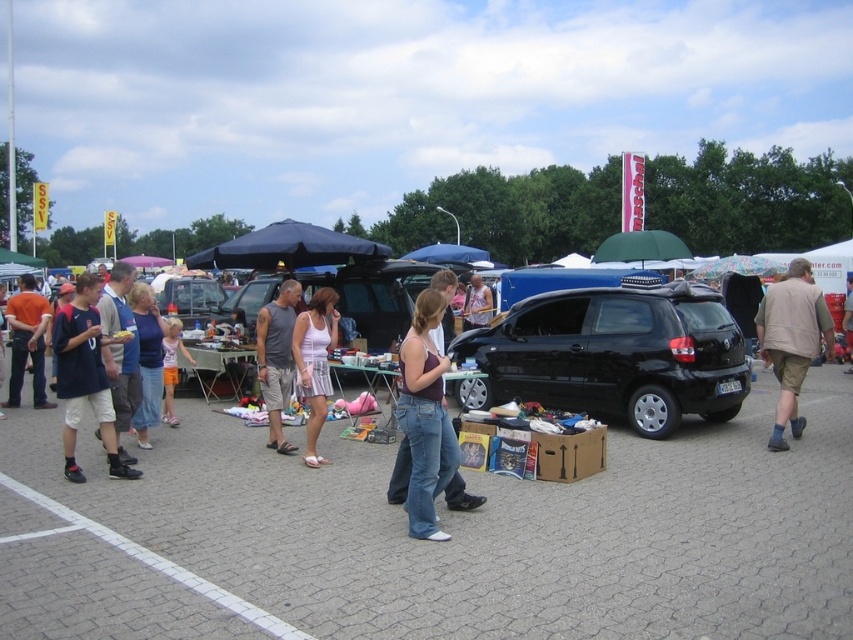
I want to click on metallic silver car at center, so click(x=190, y=300).

Describe the element at coordinates (190, 300) in the screenshot. The image size is (853, 640). I see `metallic silver car at center` at that location.

Where is `metallic silver car at center`? metallic silver car at center is located at coordinates (190, 300).

Based on the photo, does white fabric dress at center have a lesser height compared to metallic silver car at center?

No.

Is point (316, 413) behind point (158, 294)?

No, (316, 413) is closer to viewer.

Is point (297, 396) behind point (180, 305)?

That is False.

Where is `white fabric dress at center`? This screenshot has height=640, width=853. white fabric dress at center is located at coordinates (314, 362).

Can you confirm if matte black t-shirt at left is positioned below matte black tank top at center?

Indeed, matte black t-shirt at left is positioned under matte black tank top at center.

Does point (24, 282) come behind point (469, 308)?

No, (24, 282) is closer to viewer.

Where is `matte black t-shirt at left`? Image resolution: width=853 pixels, height=640 pixels. matte black t-shirt at left is located at coordinates (27, 340).